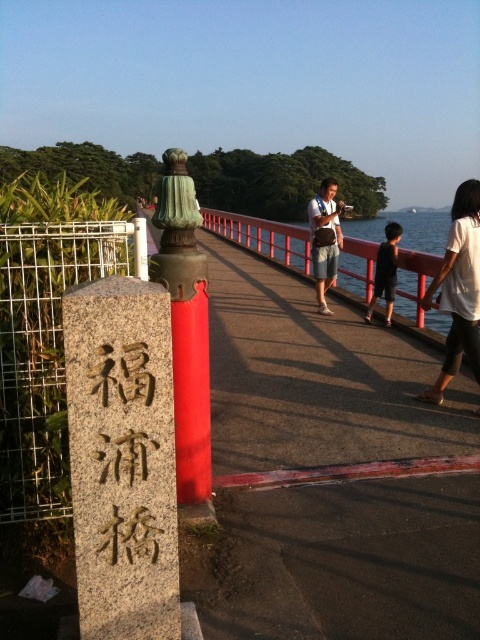
Between red polished wood post at center and light brown leather bag at center, which one has more height?

Standing taller between the two is light brown leather bag at center.

Is red polished wood post at center wider than light brown leather bag at center?

No, red polished wood post at center is not wider than light brown leather bag at center.

Which is in front, point (197, 461) or point (324, 202)?

Positioned in front is point (197, 461).

Where is `red polished wood post at center`? The height and width of the screenshot is (640, 480). red polished wood post at center is located at coordinates (186, 333).

Is point (93, 291) positioned after point (368, 308)?

No.

Who is positioned more to the left, granite stone pillar at left or black matte shirt at center?

granite stone pillar at left is more to the left.

Does point (100, 339) lie behind point (386, 224)?

That is False.

Find the location of a particular element. The height and width of the screenshot is (640, 480). granite stone pillar at left is located at coordinates (121, 458).

Can you confirm if red polished wood post at center is positioned to the right of black matte shirt at center?

Incorrect, red polished wood post at center is not on the right side of black matte shirt at center.

Is red polished wood post at center in front of black matte shirt at center?

Yes, it is.

Does point (158, 198) come farther from viewer compared to point (368, 312)?

No.

I want to click on red polished wood post at center, so click(186, 333).